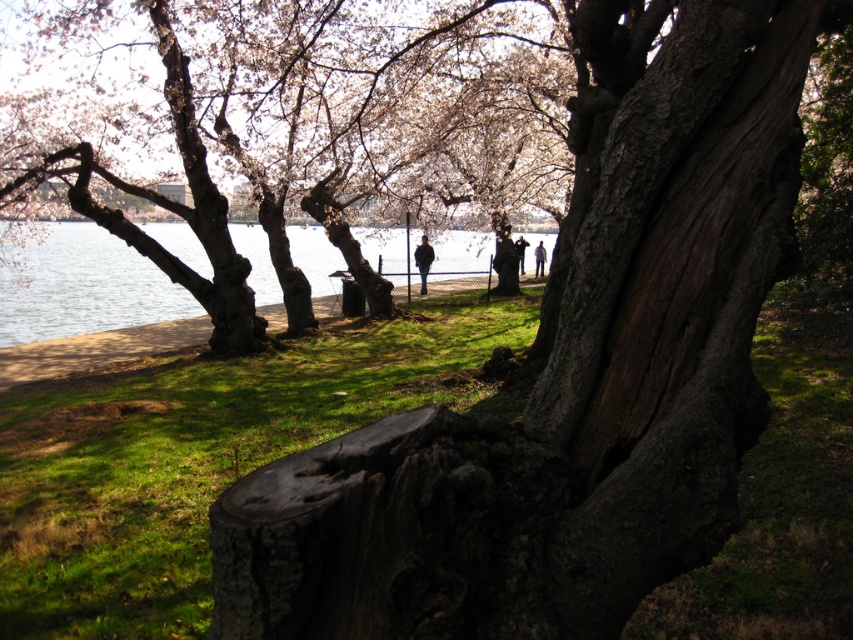
Question: Considering the real-world distances, which object is farthest from the clear water at center?

Choices:
 (A) smooth bark tree trunk at center
 (B) green grass at lower left

Answer: (A)

Question: Does smooth bark tree trunk at center lie in front of clear water at center?

Choices:
 (A) no
 (B) yes

Answer: (B)

Question: Observing the image, what is the correct spatial positioning of smooth bark tree at center in reference to clear water at center?

Choices:
 (A) below
 (B) above

Answer: (B)

Question: Which object is positioned closest to the smooth bark tree at center?

Choices:
 (A) clear water at center
 (B) green grass at lower left

Answer: (B)

Question: Where is smooth bark tree trunk at center located in relation to clear water at center in the image?

Choices:
 (A) left
 (B) right

Answer: (B)

Question: Among these objects, which one is farthest from the camera?

Choices:
 (A) green grass at lower left
 (B) smooth bark tree trunk at center
 (C) smooth bark tree at center

Answer: (C)